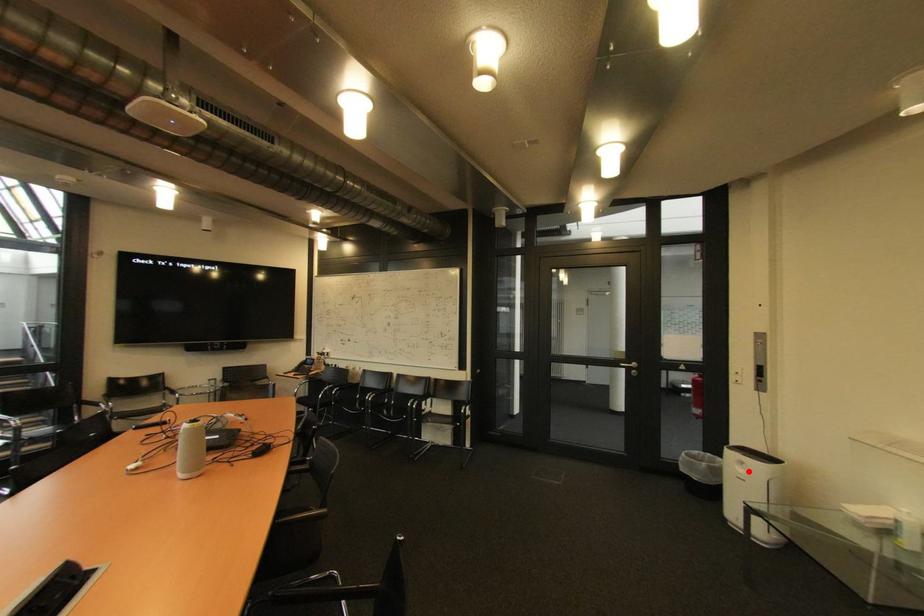
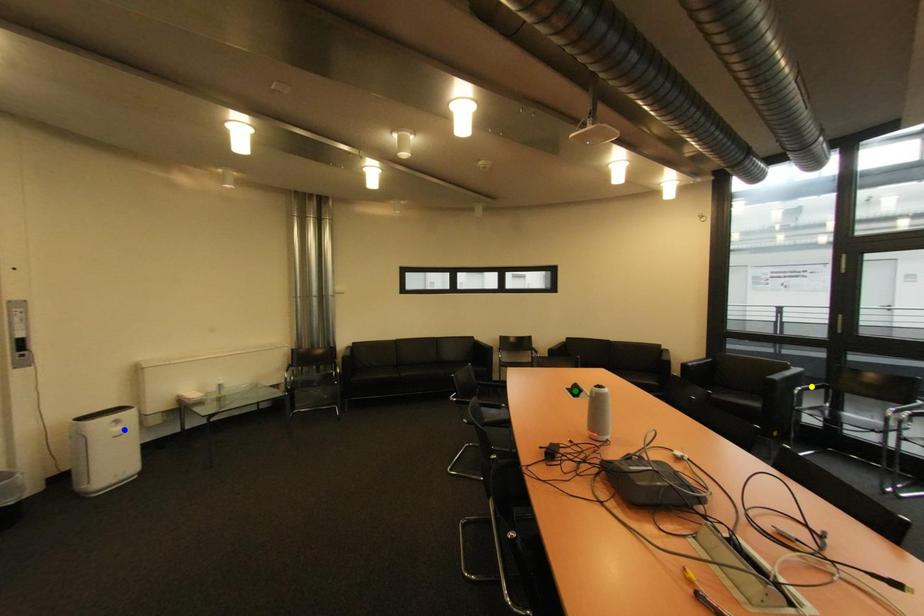
Question: I am providing you with two images of the same scene from different viewpoints. A red point is marked on the first image. You are given multiple points on the second image. Which spot in image 2 lines up with the point in image 1?

Choices:
 (A) green point
 (B) yellow point
 (C) blue point

Answer: (C)